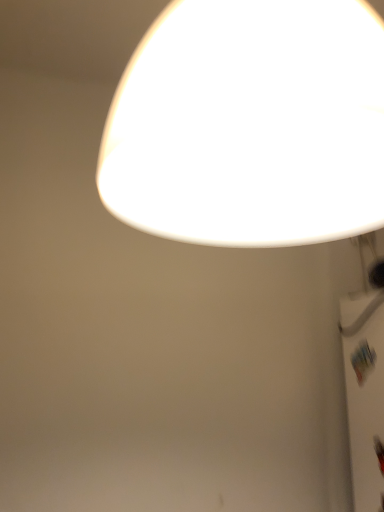
Where is `white glossy lampshade at upper center`? white glossy lampshade at upper center is located at coordinates (250, 124).

From the picture: What is the approximate height of white glossy lampshade at upper center?

It is 14.76 inches.

What do you see at coordinates (250, 124) in the screenshot? I see `white glossy lampshade at upper center` at bounding box center [250, 124].

Find the location of a particular element. white glossy lampshade at upper center is located at coordinates (250, 124).